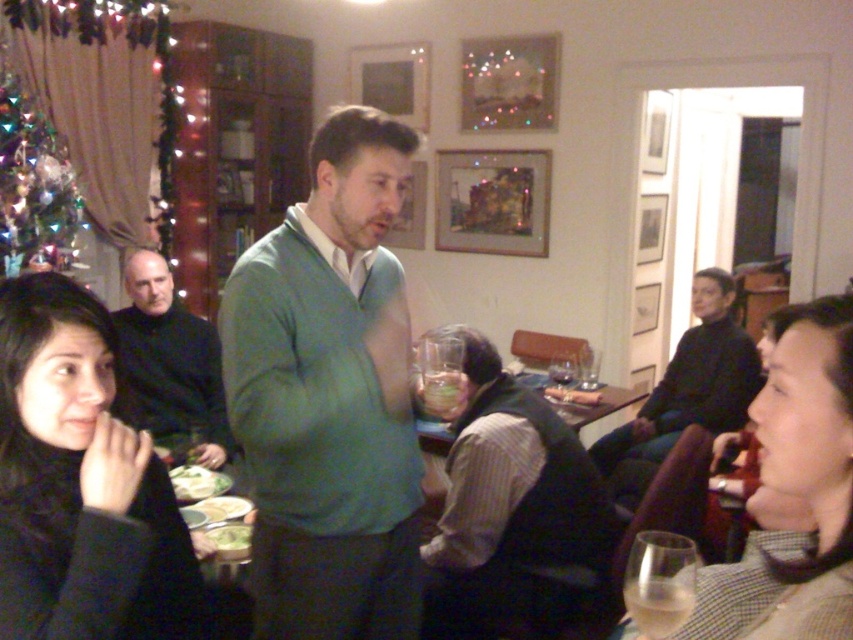
Does checkered fabric scarf at lower right have a lesser width compared to clear glass wine glass at lower right?

No.

Is point (816, 520) positioned before point (683, 580)?

No, (816, 520) is behind (683, 580).

Which is behind, point (767, 564) or point (689, 538)?

Point (689, 538)

Where is `checkered fabric scarf at lower right`? This screenshot has height=640, width=853. checkered fabric scarf at lower right is located at coordinates (793, 493).

Is clear glass wine glass at lower right shorter than green leafy vegetable at lower left?

In fact, clear glass wine glass at lower right may be taller than green leafy vegetable at lower left.

Which is more to the left, clear glass wine glass at lower right or green leafy vegetable at lower left?

From the viewer's perspective, green leafy vegetable at lower left appears more on the left side.

Identify the location of clear glass wine glass at lower right. This screenshot has width=853, height=640. (659, 582).

Does green sweater at center appear on the left side of black woolen sweater at lower left?

Incorrect, green sweater at center is not on the left side of black woolen sweater at lower left.

Does green sweater at center lie in front of black woolen sweater at lower left?

No.

Does point (355, 374) come closer to viewer compared to point (99, 636)?

No, it is behind (99, 636).

Identify the location of green sweater at center. (329, 396).